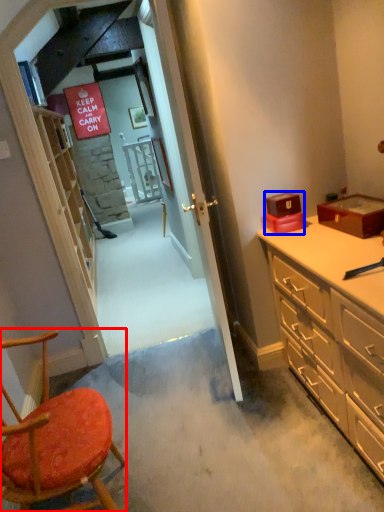
Question: Among these objects, which one is farthest to the camera, chair (highlighted by a red box) or box (highlighted by a blue box)?

Choices:
 (A) chair
 (B) box

Answer: (B)